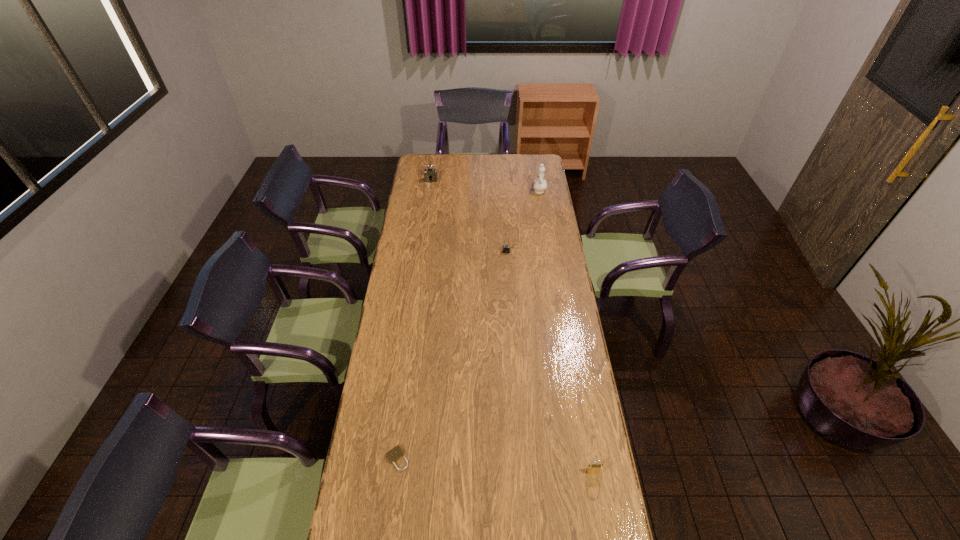
Locate an element on the screen. This screenshot has height=540, width=960. the second farthest object is located at coordinates (539, 184).

The height and width of the screenshot is (540, 960). I want to click on chinaware, so click(539, 184).

You are a GUI agent. You are given a task and a screenshot of the screen. Output one action in this format:
    pyautogui.click(x=<x>, y=<y>)
    Task: Click on the tallest padlock
    This screenshot has height=540, width=960.
    Given the screenshot: What is the action you would take?
    pyautogui.click(x=430, y=174)

The image size is (960, 540). Find the location of `the farthest padlock`. the farthest padlock is located at coordinates (430, 174).

Locate an element on the screen. The height and width of the screenshot is (540, 960). the third nearest padlock is located at coordinates (506, 248).

This screenshot has width=960, height=540. Identify the location of the third padlock from left to right. (506, 248).

Where is `the rightmost padlock`? Image resolution: width=960 pixels, height=540 pixels. the rightmost padlock is located at coordinates (592, 468).

Find the location of a particular element. This screenshot has height=540, width=960. the shortest object is located at coordinates (394, 454).

At what (x,y) coordinates should I click in order to perform the action: click on vacant area located at the spout of the chinaware. Please return your answer as a coordinate pair (x, y). Looking at the image, I should click on (536, 171).

Locate an element on the screen. The image size is (960, 540). free region located at the spout of the chinaware is located at coordinates (534, 157).